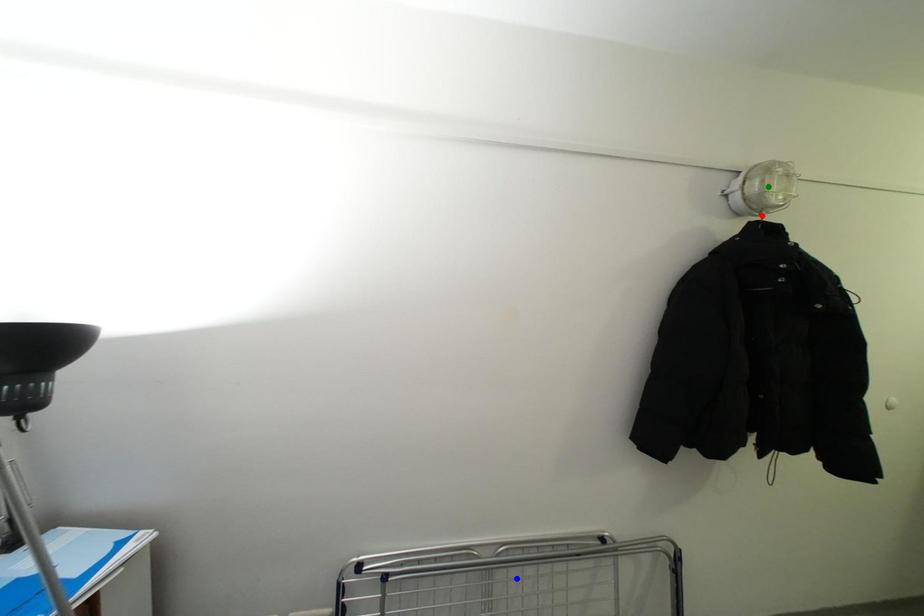
Order these from nearest to farthest:
- red point
- blue point
- green point

green point, red point, blue point